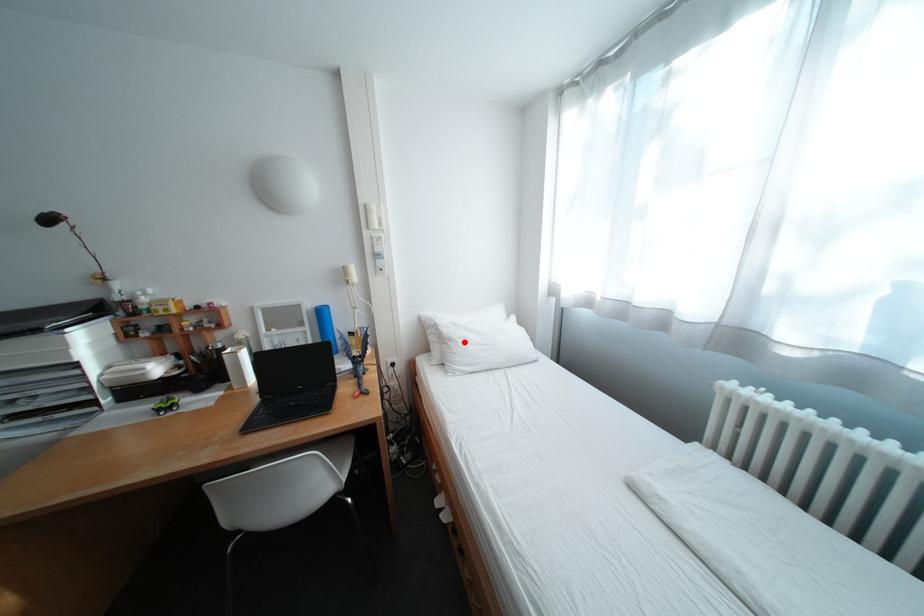
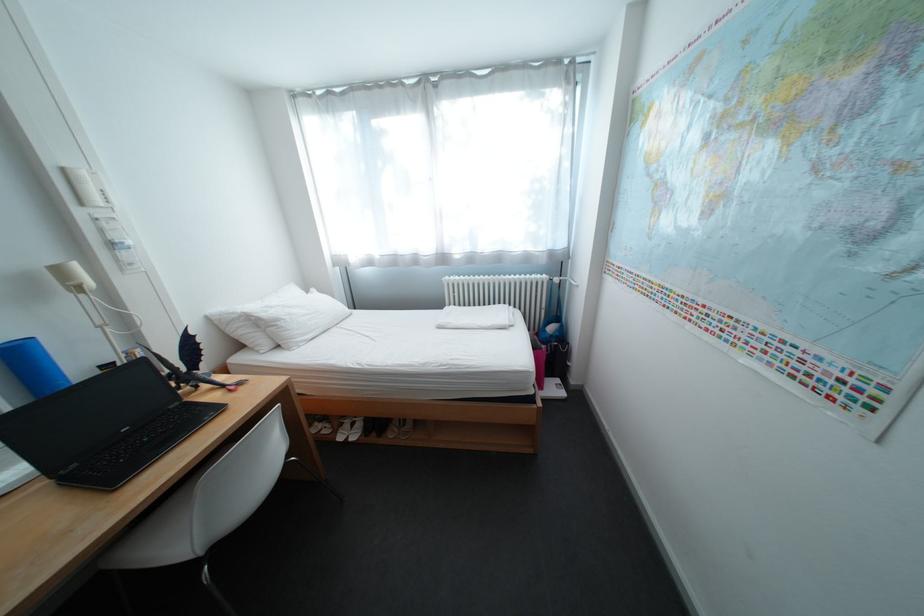
Where in the second image is the point corresponding to the highlighted location from the first image?

(292, 322)